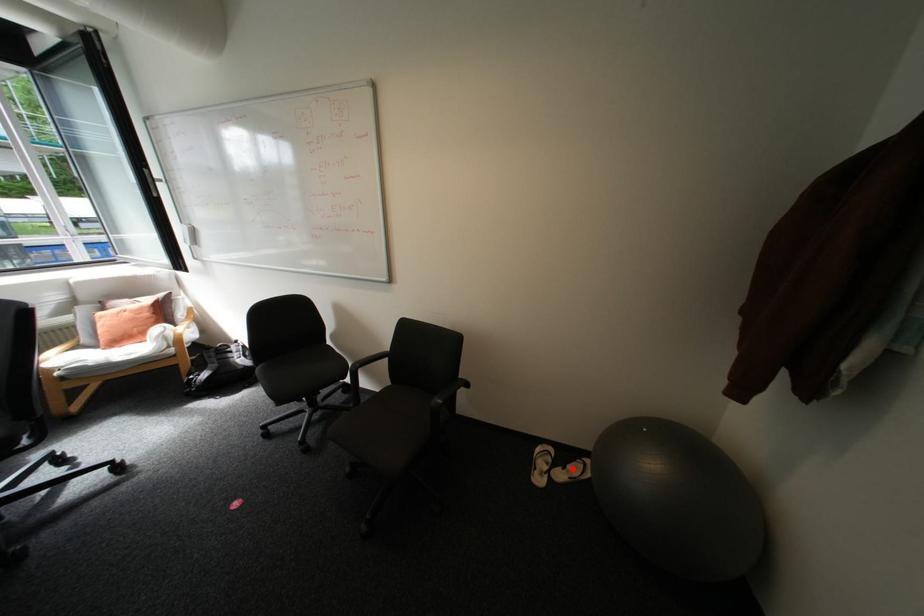
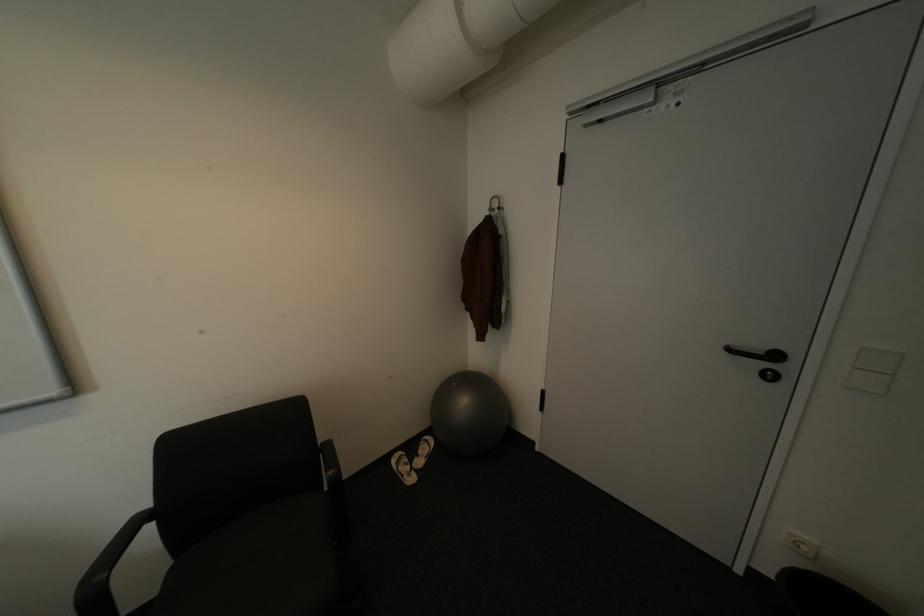
Find the pixel in the second image that matches the highlighted location in the first image.

(428, 456)